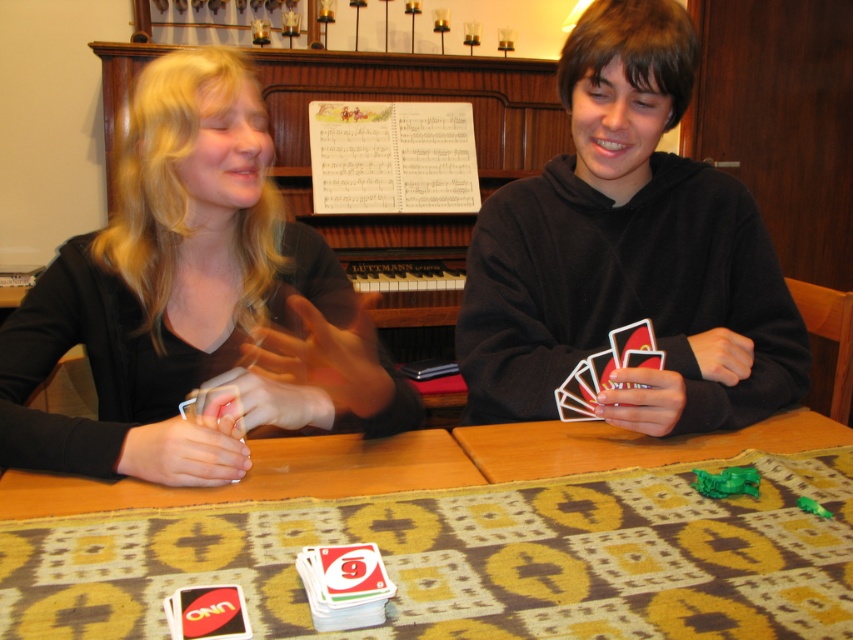
You are a card player sitting at the table. You need to place a new card between the smooth plastic cards at center and the black matte hoodie at center. According to the scene, where should you place the new card?

The smooth plastic cards at center is positioned under the black matte hoodie at center, so you should place the new card above the smooth plastic cards at center and below the black matte hoodie at center.

You are a game player who needs to place a new card exactly at the point marked as point (x=628, y=252). According to the scene, where should you place the new card?

The point (x=628, y=252) is on smooth plastic cards at center, so you should place the new card on the smooth plastic cards at center.